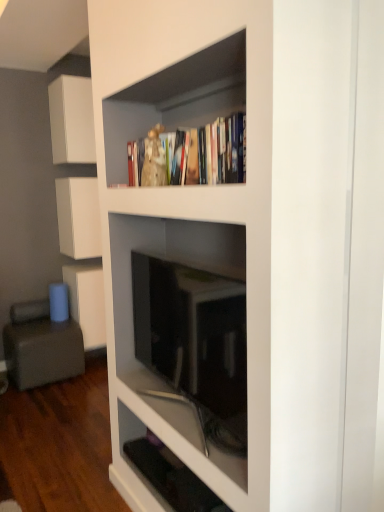
In order to face gray fabric armchair at lower left, should I rotate leftwards or rightwards?

You should rotate left by 19.324 degrees.

The width and height of the screenshot is (384, 512). What are the coordinates of `gray fabric armchair at lower left` in the screenshot? It's located at (41, 346).

In order to face white matte cabinet at upper left, the 1th cabinetry viewed from the top, should I rotate leftwards or rightwards?

Rotate left and turn 14.817 degrees.

The image size is (384, 512). What do you see at coordinates (87, 302) in the screenshot? I see `white matte cabinet at center, which ranks as the first cabinetry in bottom-to-top order` at bounding box center [87, 302].

The image size is (384, 512). What are the coordinates of `gray fabric armchair at lower left` in the screenshot? It's located at (41, 346).

From the image's perspective, which object appears higher, white matte cabinet at upper left, which is the third cabinetry from bottom to top, or black glossy shelf at lower center, positioned as the 1th shelf in bottom-to-top order?

white matte cabinet at upper left, which is the third cabinetry from bottom to top, from the image's perspective.

Does white matte cabinet at upper left, which is the third cabinetry from bottom to top, turn towards black glossy shelf at lower center, positioned as the 1th shelf in bottom-to-top order?

No.

Considering the relative sizes of white matte cabinet at upper left, which is the third cabinetry from bottom to top, and black glossy shelf at lower center, the second shelf viewed from the top, in the image provided, is white matte cabinet at upper left, which is the third cabinetry from bottom to top, wider than black glossy shelf at lower center, the second shelf viewed from the top,?

Yes.

Considering the positions of point (66, 120) and point (127, 438), is point (66, 120) closer or farther from the camera than point (127, 438)?

Clearly, point (66, 120) is more distant from the camera than point (127, 438).

Is gray fabric armchair at lower left facing towards white matte cabinet at upper left, the second cabinetry in the top-to-bottom sequence?

No, gray fabric armchair at lower left is not oriented towards white matte cabinet at upper left, the second cabinetry in the top-to-bottom sequence.

Which of these two, gray fabric armchair at lower left or white matte cabinet at upper left, the 2th cabinetry ordered from the bottom, is smaller?

Smaller between the two is white matte cabinet at upper left, the 2th cabinetry ordered from the bottom.

From the image's perspective, relative to white matte cabinet at upper left, the 2th cabinetry ordered from the bottom, is gray fabric armchair at lower left above or below?

Based on their image positions, gray fabric armchair at lower left is located beneath white matte cabinet at upper left, the 2th cabinetry ordered from the bottom.

Consider the image. Is gray fabric armchair at lower left thinner than white matte cabinet at upper left, the 2th cabinetry ordered from the bottom?

Incorrect, the width of gray fabric armchair at lower left is not less than that of white matte cabinet at upper left, the 2th cabinetry ordered from the bottom.

How different are the orientations of white matte cabinet at upper left, which is the third cabinetry from bottom to top, and matte black tv at center, which ranks as the 1th shelf in top-to-bottom order, in degrees?

The facing directions of white matte cabinet at upper left, which is the third cabinetry from bottom to top, and matte black tv at center, which ranks as the 1th shelf in top-to-bottom order, are 90.7 degrees apart.

Could you measure the distance between white matte cabinet at upper left, the 1th cabinetry viewed from the top, and matte black tv at center, marked as the 2th shelf in a bottom-to-top arrangement?

5.69 feet.

Based on the photo, considering the positions of objects white matte cabinet at upper left, which is the third cabinetry from bottom to top, and matte black tv at center, which ranks as the 1th shelf in top-to-bottom order, in the image provided, who is behind, white matte cabinet at upper left, which is the third cabinetry from bottom to top, or matte black tv at center, which ranks as the 1th shelf in top-to-bottom order,?

white matte cabinet at upper left, which is the third cabinetry from bottom to top, is further from the camera.

From the picture: Which is correct: white matte cabinet at upper left, the 1th cabinetry viewed from the top, is inside matte black tv at center, marked as the 2th shelf in a bottom-to-top arrangement, or outside of it?

white matte cabinet at upper left, the 1th cabinetry viewed from the top, is spatially situated outside matte black tv at center, marked as the 2th shelf in a bottom-to-top arrangement.

Looking at this image, is white matte cabinet at center, which ranks as the first cabinetry in bottom-to-top order, aimed at matte black tv at center, marked as the 2th shelf in a bottom-to-top arrangement?

Yes, white matte cabinet at center, which ranks as the first cabinetry in bottom-to-top order, is turned towards matte black tv at center, marked as the 2th shelf in a bottom-to-top arrangement.

Between white matte cabinet at center, which ranks as the first cabinetry in bottom-to-top order, and matte black tv at center, marked as the 2th shelf in a bottom-to-top arrangement, which one appears on the left side from the viewer's perspective?

Positioned to the left is white matte cabinet at center, which ranks as the first cabinetry in bottom-to-top order.

Considering the sizes of objects white matte cabinet at center, which ranks as the first cabinetry in bottom-to-top order, and matte black tv at center, marked as the 2th shelf in a bottom-to-top arrangement, in the image provided, who is smaller, white matte cabinet at center, which ranks as the first cabinetry in bottom-to-top order, or matte black tv at center, marked as the 2th shelf in a bottom-to-top arrangement,?

With smaller size is matte black tv at center, marked as the 2th shelf in a bottom-to-top arrangement.

From the image's perspective, is matte black tv at center, which ranks as the 1th shelf in top-to-bottom order, positioned above or below white matte cabinet at center, the third cabinetry when ordered from top to bottom?

Clearly, from the image's perspective, matte black tv at center, which ranks as the 1th shelf in top-to-bottom order, is above white matte cabinet at center, the third cabinetry when ordered from top to bottom.

Which is more distant, (121, 317) or (92, 344)?

Positioned behind is point (92, 344).

You are a GUI agent. You are given a task and a screenshot of the screen. Output one action in this format:
    pyautogui.click(x=<x>, y=<y>)
    Task: Click on the shelf above the white matte cabinet at center, which ranks as the first cabinetry in bottom-to-top order (from a real-world perspective)
    
    Given the screenshot: What is the action you would take?
    (x=131, y=275)

Based on the photo, is matte black tv at center, marked as the 2th shelf in a bottom-to-top arrangement, closer to camera compared to white matte cabinet at center, which ranks as the first cabinetry in bottom-to-top order?

Yes, the depth of matte black tv at center, marked as the 2th shelf in a bottom-to-top arrangement, is less than that of white matte cabinet at center, which ranks as the first cabinetry in bottom-to-top order.

Between white matte cabinet at upper left, the second cabinetry in the top-to-bottom sequence, and white matte cabinet at upper left, which is the third cabinetry from bottom to top, which one has less height?

white matte cabinet at upper left, which is the third cabinetry from bottom to top.

Looking at this image, can you confirm if white matte cabinet at upper left, the second cabinetry in the top-to-bottom sequence, is smaller than white matte cabinet at upper left, the 1th cabinetry viewed from the top?

Incorrect, white matte cabinet at upper left, the second cabinetry in the top-to-bottom sequence, is not smaller in size than white matte cabinet at upper left, the 1th cabinetry viewed from the top.

Where is `cabinetry located in front of the white matte cabinet at upper left, the second cabinetry in the top-to-bottom sequence`? The image size is (384, 512). cabinetry located in front of the white matte cabinet at upper left, the second cabinetry in the top-to-bottom sequence is located at coordinates (72, 120).

From the image's perspective, which is above, gray fabric armchair at lower left or white matte cabinet at center, which ranks as the first cabinetry in bottom-to-top order?

white matte cabinet at center, which ranks as the first cabinetry in bottom-to-top order, is shown above in the image.

Which of these two, gray fabric armchair at lower left or white matte cabinet at center, the third cabinetry when ordered from top to bottom, is bigger?

gray fabric armchair at lower left.

In terms of height, does gray fabric armchair at lower left look taller or shorter compared to white matte cabinet at center, which ranks as the first cabinetry in bottom-to-top order?

In the image, gray fabric armchair at lower left appears to be shorter than white matte cabinet at center, which ranks as the first cabinetry in bottom-to-top order.

You are a GUI agent. You are given a task and a screenshot of the screen. Output one action in this format:
    pyautogui.click(x=<x>, y=<y>)
    Task: Click on the armchair located in front of the white matte cabinet at center, the third cabinetry when ordered from top to bottom
    
    Given the screenshot: What is the action you would take?
    pyautogui.click(x=41, y=346)

There is a black glossy shelf at lower center, the second shelf viewed from the top. In order to click on the 3rd cabinetry above it (from the image's perspective) in this screenshot , I will do `click(72, 120)`.

Locate an element on the screen. armchair on the left side of white matte cabinet at upper left, the 2th cabinetry ordered from the bottom is located at coordinates [41, 346].

When comparing their distances from black glossy shelf at lower center, positioned as the 1th shelf in bottom-to-top order, does white matte cabinet at upper left, the 1th cabinetry viewed from the top, or matte black tv at center, which ranks as the 1th shelf in top-to-bottom order, seem further?

Based on the image, white matte cabinet at upper left, the 1th cabinetry viewed from the top, appears to be further to black glossy shelf at lower center, positioned as the 1th shelf in bottom-to-top order.

In the scene shown: Which object lies nearer to the anchor point white matte cabinet at upper left, the second cabinetry in the top-to-bottom sequence, white matte cabinet at upper left, which is the third cabinetry from bottom to top, or gray fabric armchair at lower left?

white matte cabinet at upper left, which is the third cabinetry from bottom to top, lies closer to white matte cabinet at upper left, the second cabinetry in the top-to-bottom sequence, than the other object.

When comparing their distances from white matte cabinet at upper left, the second cabinetry in the top-to-bottom sequence, does black glossy shelf at lower center, the second shelf viewed from the top, or white matte cabinet at center, the third cabinetry when ordered from top to bottom, seem further?

black glossy shelf at lower center, the second shelf viewed from the top, is further to white matte cabinet at upper left, the second cabinetry in the top-to-bottom sequence.

When comparing their distances from gray fabric armchair at lower left, does white matte cabinet at center, the third cabinetry when ordered from top to bottom, or matte black tv at center, marked as the 2th shelf in a bottom-to-top arrangement, seem further?

matte black tv at center, marked as the 2th shelf in a bottom-to-top arrangement, is positioned further to the anchor gray fabric armchair at lower left.

Looking at the image, which one is located closer to matte black tv at center, marked as the 2th shelf in a bottom-to-top arrangement, black glossy shelf at lower center, positioned as the 1th shelf in bottom-to-top order, or white matte cabinet at upper left, the 2th cabinetry ordered from the bottom?

Among the two, black glossy shelf at lower center, positioned as the 1th shelf in bottom-to-top order, is located nearer to matte black tv at center, marked as the 2th shelf in a bottom-to-top arrangement.

Considering their positions, is white matte cabinet at center, the third cabinetry when ordered from top to bottom, positioned further to black glossy shelf at lower center, positioned as the 1th shelf in bottom-to-top order, than white matte cabinet at upper left, the 1th cabinetry viewed from the top?

The object further to black glossy shelf at lower center, positioned as the 1th shelf in bottom-to-top order, is white matte cabinet at upper left, the 1th cabinetry viewed from the top.

Which object lies further to the anchor point matte black tv at center, marked as the 2th shelf in a bottom-to-top arrangement, gray fabric armchair at lower left or black glossy shelf at lower center, the second shelf viewed from the top?

gray fabric armchair at lower left is further to matte black tv at center, marked as the 2th shelf in a bottom-to-top arrangement.

In the scene shown: Estimate the real-world distances between objects in this image. Which object is closer to white matte cabinet at upper left, the 1th cabinetry viewed from the top, matte black tv at center, marked as the 2th shelf in a bottom-to-top arrangement, or gray fabric armchair at lower left?

Based on the image, gray fabric armchair at lower left appears to be nearer to white matte cabinet at upper left, the 1th cabinetry viewed from the top.

I want to click on armchair between black glossy shelf at lower center, the second shelf viewed from the top, and white matte cabinet at center, which ranks as the first cabinetry in bottom-to-top order, from front to back, so click(41, 346).

Find the location of `armchair positioned between matte black tv at center, which ranks as the 1th shelf in top-to-bottom order, and white matte cabinet at center, the third cabinetry when ordered from top to bottom, from near to far`. armchair positioned between matte black tv at center, which ranks as the 1th shelf in top-to-bottom order, and white matte cabinet at center, the third cabinetry when ordered from top to bottom, from near to far is located at coordinates [41, 346].

This screenshot has height=512, width=384. Identify the location of cabinetry between matte black tv at center, marked as the 2th shelf in a bottom-to-top arrangement, and white matte cabinet at upper left, the 2th cabinetry ordered from the bottom, in the front-back direction. (72, 120).

The image size is (384, 512). In order to click on armchair between white matte cabinet at upper left, the 1th cabinetry viewed from the top, and black glossy shelf at lower center, the second shelf viewed from the top, vertically in this screenshot , I will do `click(41, 346)`.